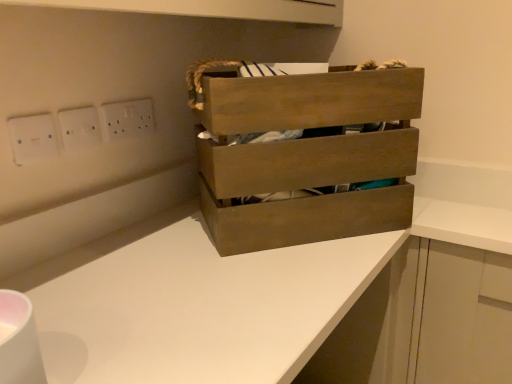
Question: From a real-world perspective, is wooden crate at center located beneath white plastic electric outlet at upper center, the third electric outlet in the front-to-back sequence?

Choices:
 (A) yes
 (B) no

Answer: (A)

Question: Does wooden crate at center touch white plastic electric outlet at upper center, positioned as the first electric outlet in back-to-front order?

Choices:
 (A) no
 (B) yes

Answer: (A)

Question: Is wooden crate at center looking in the opposite direction of white plastic electric outlet at upper center, which is counted as the first electric outlet, starting from the right?

Choices:
 (A) no
 (B) yes

Answer: (A)

Question: Does wooden crate at center come behind white plastic electric outlet at upper center, which is counted as the first electric outlet, starting from the right?

Choices:
 (A) yes
 (B) no

Answer: (B)

Question: From the image's perspective, is wooden crate at center on top of white plastic electric outlet at upper center, the third electric outlet in the front-to-back sequence?

Choices:
 (A) no
 (B) yes

Answer: (A)

Question: In terms of width, does wooden crate at center look wider or thinner when compared to white plastic socket at upper left, positioned as the 2th electric outlet in back-to-front order?

Choices:
 (A) wide
 (B) thin

Answer: (A)

Question: From the image's perspective, is wooden crate at center located above or below white plastic socket at upper left, positioned as the 2th electric outlet in back-to-front order?

Choices:
 (A) below
 (B) above

Answer: (A)

Question: Considering the positions of point (202, 175) and point (76, 117), is point (202, 175) closer or farther from the camera than point (76, 117)?

Choices:
 (A) closer
 (B) farther

Answer: (B)

Question: Based on their sizes in the image, would you say wooden crate at center is bigger or smaller than white plastic socket at upper left, arranged as the 2th electric outlet when viewed from the left?

Choices:
 (A) small
 (B) big

Answer: (B)

Question: Considering the relative positions of white plastic socket at upper left, positioned as the 2th electric outlet in back-to-front order, and white matte counter at center in the image provided, is white plastic socket at upper left, positioned as the 2th electric outlet in back-to-front order, to the left or to the right of white matte counter at center?

Choices:
 (A) left
 (B) right

Answer: (A)

Question: From a real-world perspective, is white plastic socket at upper left, arranged as the 2th electric outlet when viewed from the left, above or below white matte counter at center?

Choices:
 (A) below
 (B) above

Answer: (B)

Question: In terms of height, does white plastic socket at upper left, the second electric outlet from the front, look taller or shorter compared to white matte counter at center?

Choices:
 (A) tall
 (B) short

Answer: (B)

Question: From the image's perspective, is white plastic socket at upper left, the second electric outlet from the front, located above or below white matte counter at center?

Choices:
 (A) below
 (B) above

Answer: (B)

Question: From a real-world perspective, is white plastic electrical outlet at upper left, placed as the 1th electric outlet when sorted from front to back, physically located above or below white plastic socket at upper left, arranged as the 2th electric outlet when viewed from the left?

Choices:
 (A) below
 (B) above

Answer: (A)

Question: Is white plastic electrical outlet at upper left, arranged as the 3th electric outlet when viewed from the back, to the left or to the right of white plastic socket at upper left, arranged as the 2th electric outlet when viewed from the left, in the image?

Choices:
 (A) left
 (B) right

Answer: (A)